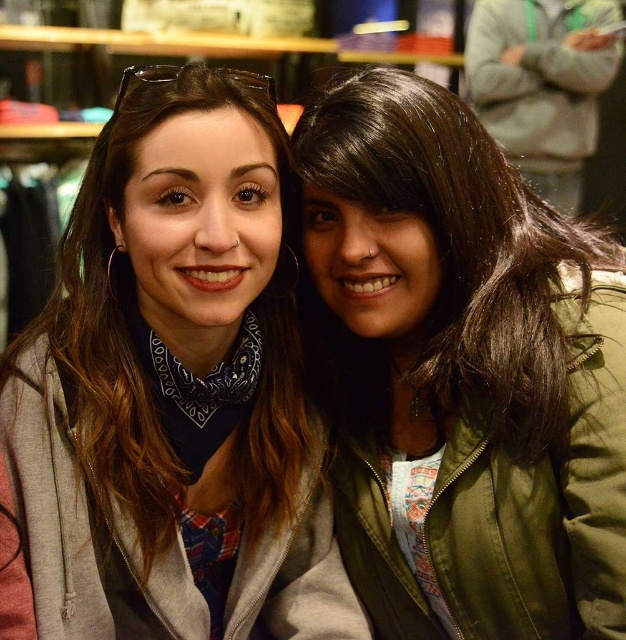
Question: Among these points, which one is nearest to the camera?

Choices:
 (A) (493, 92)
 (B) (423, 548)
 (C) (24, 456)

Answer: (C)

Question: Which of the following is the farthest from the observer?

Choices:
 (A) gray fleece jacket at center
 (B) green leather jacket at center

Answer: (B)

Question: Can you confirm if gray fleece jacket at center is thinner than gray fleece jacket at upper right?

Choices:
 (A) no
 (B) yes

Answer: (B)

Question: Is green leather jacket at center bigger than gray fleece jacket at upper right?

Choices:
 (A) yes
 (B) no

Answer: (B)

Question: Is green leather jacket at center above gray fleece jacket at center?

Choices:
 (A) yes
 (B) no

Answer: (A)

Question: Which object is the farthest from the gray fleece jacket at upper right?

Choices:
 (A) gray fleece jacket at center
 (B) green leather jacket at center

Answer: (A)